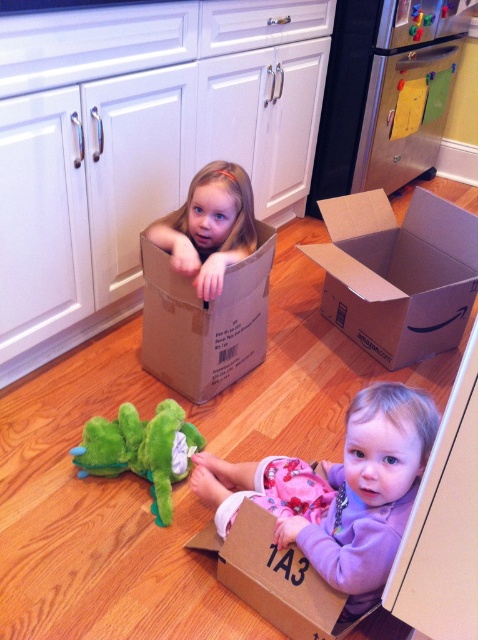
You are a delivery person who needs to place a new package on the kitchen floor. The new package is the same size as the light brown cardboard box at upper center. Is there enough space between the brown cardboard box at center and the kitchen cabinets to place the new package?

The brown cardboard box at center is wider than the light brown cardboard box at upper center. Therefore, there is sufficient space between the brown cardboard box at center and the kitchen cabinets to place the new package since the new package is smaller in width.

You are a parent trying to organize the kitchen. You need to move the cardboard box at center and the light brown cardboard box at upper center to a different room. Which box should you move first if you want to access the one behind them?

You should move the cardboard box at center first because it is positioned on the right side of the light brown cardboard box at upper center, meaning it is in front of it and blocking access.

You are a delivery person who needs to place a package on the counter. The counter is located at the point with coordinates (337, 492). There is a purple soft toddler at lower center at that point. Can you safely place the package there?

The purple soft toddler at lower center is located at point (337, 492), so you cannot safely place the package there as the toddler is occupying that spot.